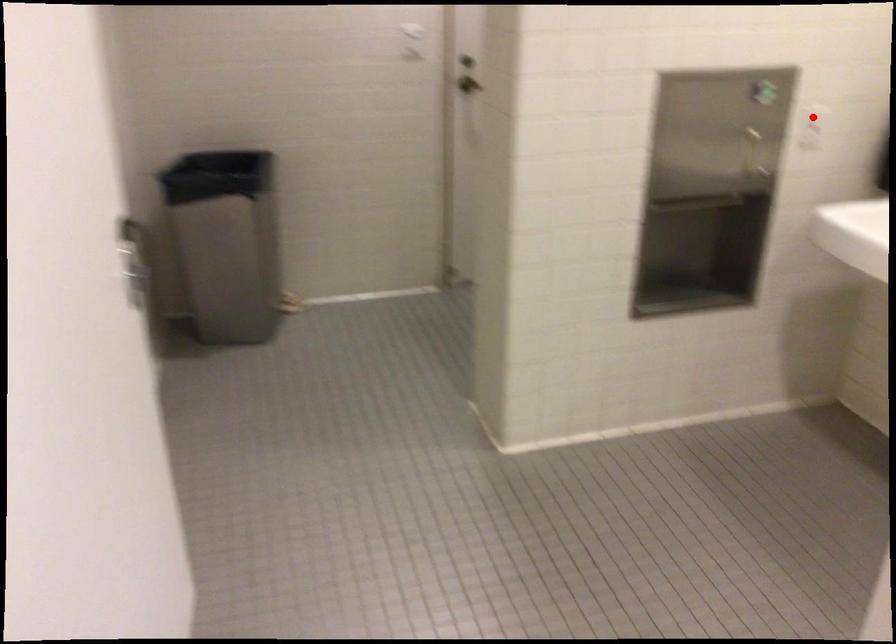
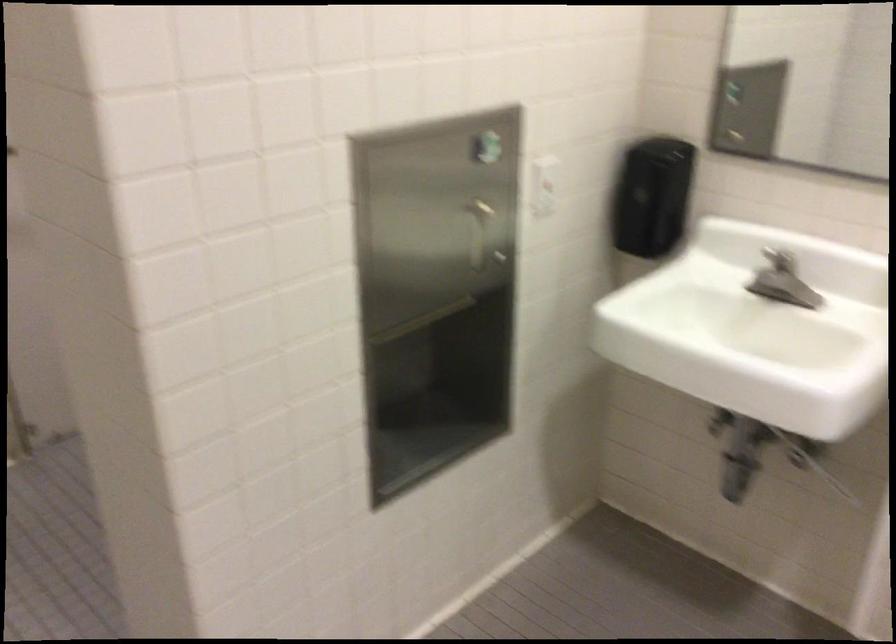
Find the pixel in the second image that matches the highlighted location in the first image.

(543, 185)